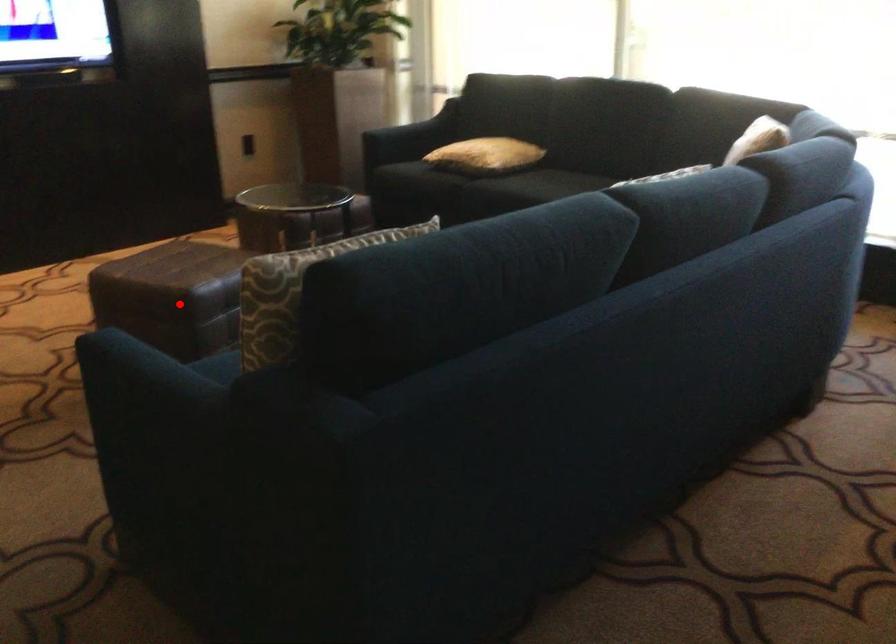
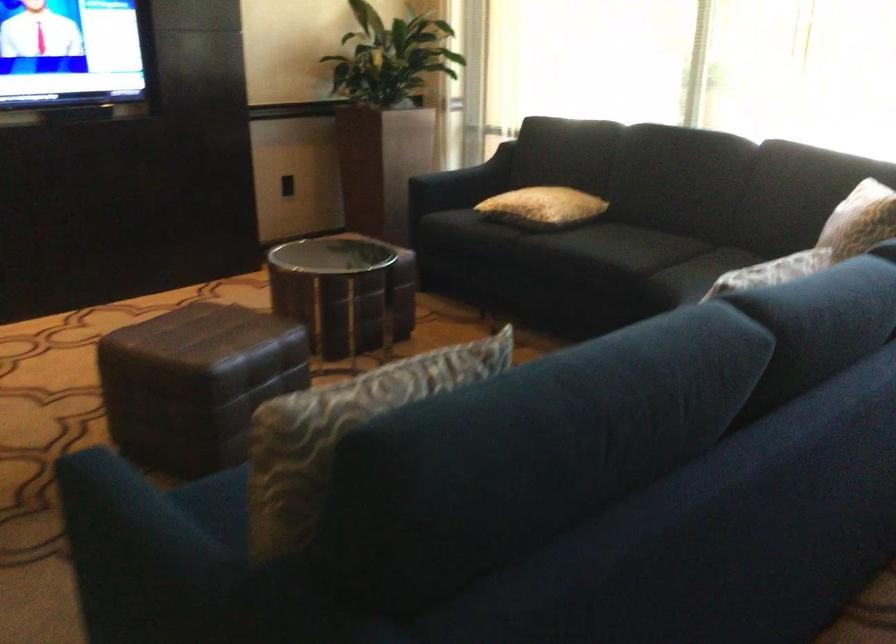
Where in the second image is the point corresponding to the highlighted location from the first image?

(195, 383)